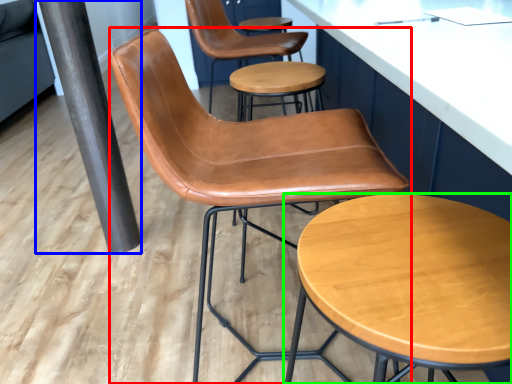
Question: Estimate the real-world distances between objects in this image. Which object is closer to chair (highlighted by a red box), beam (highlighted by a blue box) or stool (highlighted by a green box)?

Choices:
 (A) beam
 (B) stool

Answer: (B)